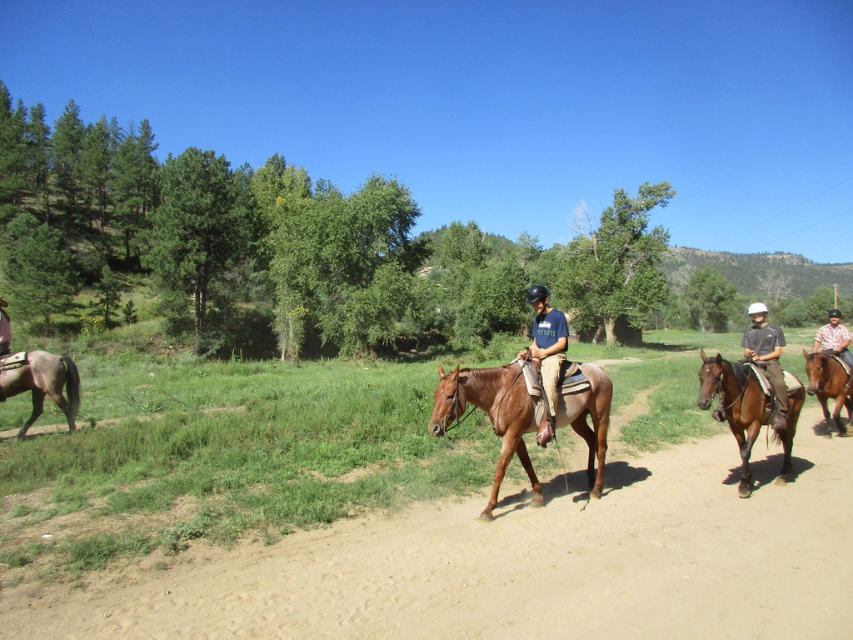
Question: Can you confirm if brown glossy horse at center is wider than plaid shirt at center?

Choices:
 (A) yes
 (B) no

Answer: (B)

Question: Considering the real-world distances, which object is closest to the brown glossy horse at right?

Choices:
 (A) plaid shirt at center
 (B) brown leather saddle at center
 (C) brown glossy horse at center-right
 (D) dark gray fabric shirt at center

Answer: (C)

Question: Which point appears farthest from the camera in this image?

Choices:
 (A) (553, 426)
 (B) (708, 356)

Answer: (B)

Question: Can you confirm if brown matte horse at left is positioned above matte blue shirt at center?

Choices:
 (A) no
 (B) yes

Answer: (A)

Question: Which is nearer to the brown glossy horse at right?

Choices:
 (A) dark gray fabric shirt at center
 (B) brown glossy horse at center-right
 (C) plaid shirt at center

Answer: (B)

Question: Where is dark gray fabric shirt at center located in relation to brown leather saddle at center in the image?

Choices:
 (A) above
 (B) below

Answer: (B)